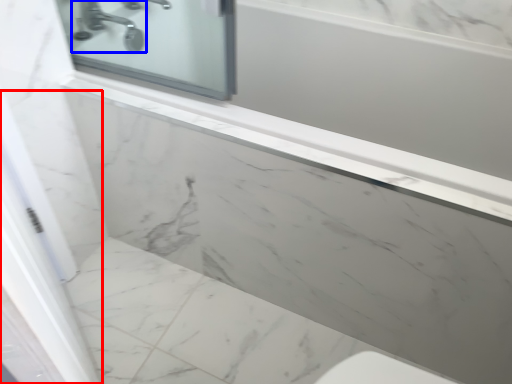
Question: Which point is closer to the camera, screen door (highlighted by a red box) or tap (highlighted by a blue box)?

Choices:
 (A) screen door
 (B) tap

Answer: (A)